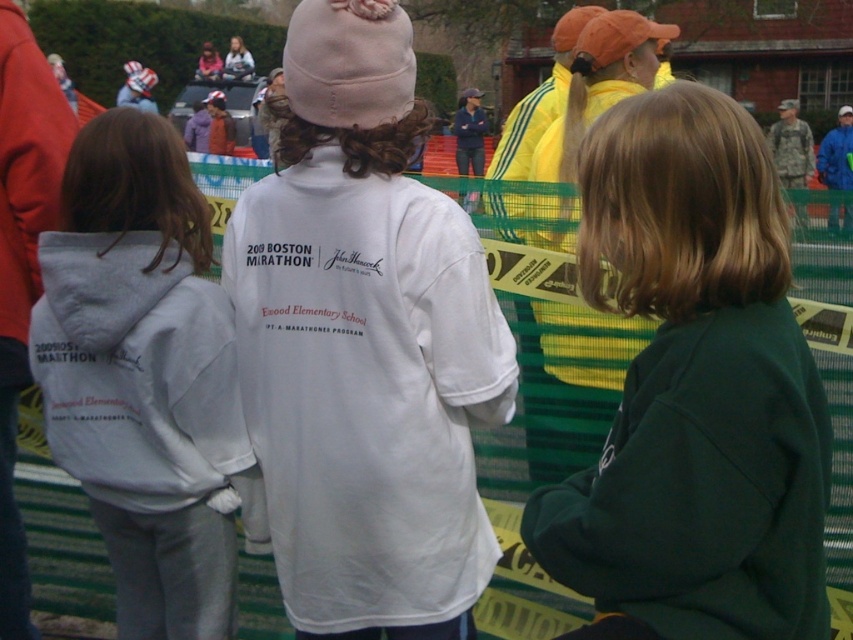
Question: Is gray fleece sweatshirt at center to the left of matte white sweatshirt at upper center from the viewer's perspective?

Choices:
 (A) no
 (B) yes

Answer: (A)

Question: Which is nearer to the blue fabric jacket at upper right?

Choices:
 (A) gray fleece sweatshirt at center
 (B) matte white sweatshirt at upper center

Answer: (A)

Question: Which of these objects is positioned farthest from the dark green sweatshirt at center?

Choices:
 (A) gray fleece sweatshirt at center
 (B) matte white sweatshirt at upper center
 (C) blue fabric jacket at upper right

Answer: (B)

Question: Which object appears closest to the camera in this image?

Choices:
 (A) dark green sweatshirt at center
 (B) blue fabric jacket at upper right

Answer: (A)

Question: Is white cotton sweatshirt at center closer to camera compared to gray fleece sweatshirt at center?

Choices:
 (A) yes
 (B) no

Answer: (A)

Question: From the image, what is the correct spatial relationship of gray fleece sweatshirt at center in relation to matte white sweatshirt at upper center?

Choices:
 (A) below
 (B) above

Answer: (A)